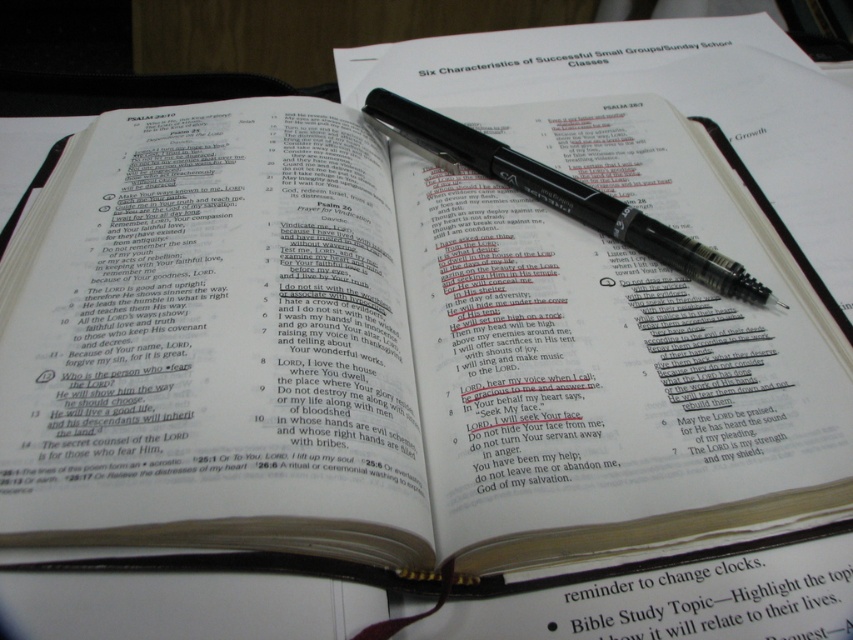
Is point (590, 614) positioned in front of point (459, 65)?

Yes, it is.

Which is behind, point (819, 627) or point (543, 42)?

The point (543, 42) is behind.

The image size is (853, 640). I want to click on white paper at center, so click(x=718, y=598).

You are a GUI agent. You are given a task and a screenshot of the screen. Output one action in this format:
    pyautogui.click(x=<x>, y=<y>)
    Task: Click on the white paper at center
    This screenshot has height=640, width=853.
    Given the screenshot: What is the action you would take?
    pyautogui.click(x=718, y=598)

Does black plastic pen at center appear on the right side of white paper at upper center?

In fact, black plastic pen at center is to the left of white paper at upper center.

Is point (569, 200) positioned before point (612, 42)?

Yes, it is.

This screenshot has height=640, width=853. Find the location of `black plastic pen at center`. black plastic pen at center is located at coordinates (558, 193).

What do you see at coordinates (718, 598) in the screenshot? This screenshot has width=853, height=640. I see `white paper at center` at bounding box center [718, 598].

Is point (653, 572) positioned behind point (675, 243)?

No, (653, 572) is closer to viewer.

At what (x,y) coordinates should I click in order to perform the action: click on white paper at center. Please return your answer as a coordinate pair (x, y). Looking at the image, I should click on (718, 598).